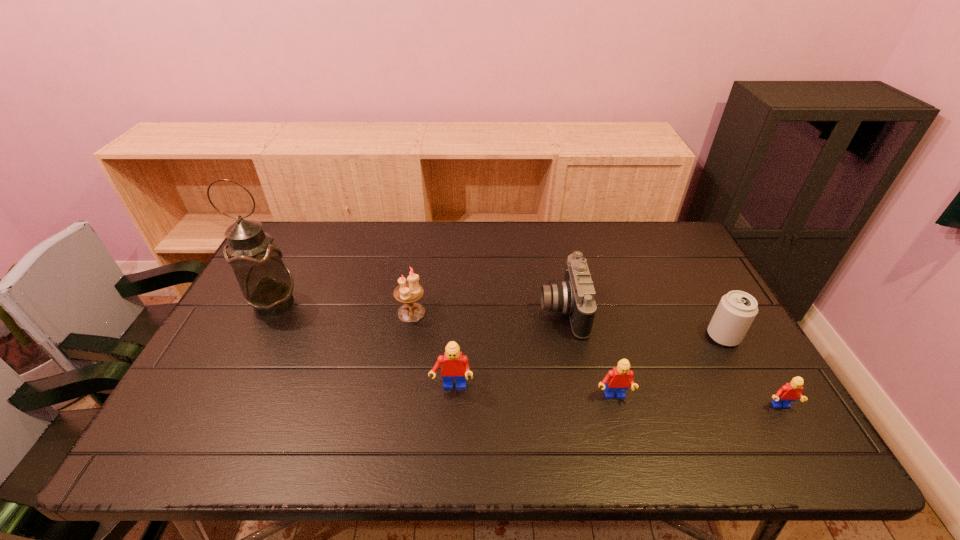
Locate an element on the screen. vacant region at the far edge of the desktop is located at coordinates (385, 226).

The image size is (960, 540). I want to click on vacant region at the near edge of the desktop, so click(x=284, y=391).

Image resolution: width=960 pixels, height=540 pixels. What are the coordinates of `vacant space at the left edge of the desktop` in the screenshot? It's located at (235, 310).

Identify the location of vacant region at the right edge. (707, 282).

In the image, there is a desktop. Where is `vacant space at the far left corner`? The height and width of the screenshot is (540, 960). vacant space at the far left corner is located at coordinates (315, 245).

Identify the location of free space at the near left corner. This screenshot has height=540, width=960. (220, 402).

Identify the location of vacant area at the near right corner. (763, 405).

The height and width of the screenshot is (540, 960). What are the coordinates of `free space between the camera and the leftmost Lego` in the screenshot? It's located at (507, 349).

Identify the location of empty space that is in between the second Lego from right to left and the camera. (588, 354).

The height and width of the screenshot is (540, 960). Identify the location of blank region between the second Lego from right to left and the shortest Lego. (696, 402).